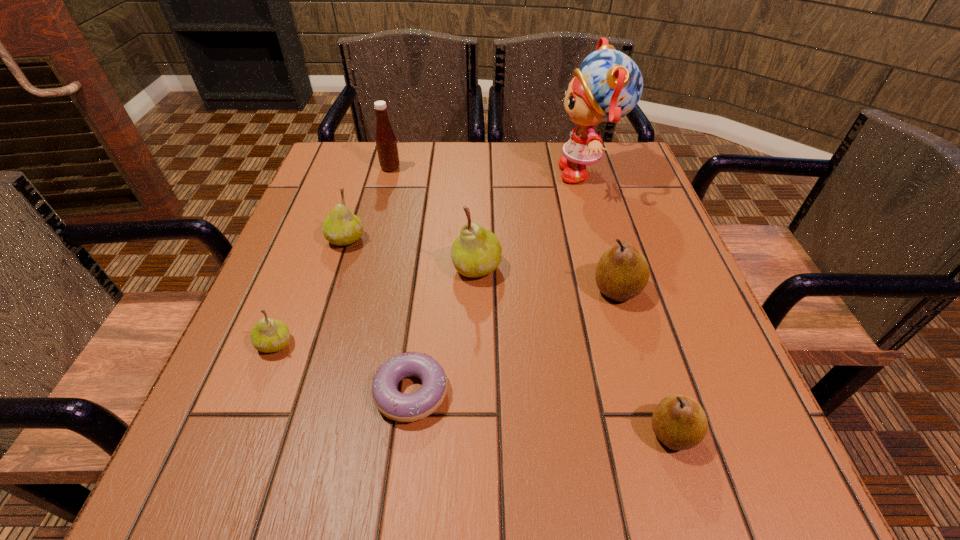
Find the location of a particular element. vacant space at the far edge of the desktop is located at coordinates (528, 178).

Where is `vacant space at the near edge of the desktop`? The width and height of the screenshot is (960, 540). vacant space at the near edge of the desktop is located at coordinates (531, 488).

Find the location of a particular element. vacant space at the left edge of the desktop is located at coordinates (314, 254).

In the image, there is a desktop. What are the coordinates of `vacant space at the right edge` in the screenshot? It's located at (634, 311).

What are the coordinates of `free region at the near right corner of the desktop` in the screenshot? It's located at (708, 442).

In order to click on free space that is in between the smallest green pear and the shortest object in this screenshot , I will do 343,368.

Image resolution: width=960 pixels, height=540 pixels. What are the coordinates of `blank region between the smallest green pear and the rightmost green pear` in the screenshot? It's located at (376, 306).

Locate an element on the screen. This screenshot has height=540, width=960. free space between the tallest object and the second biggest green pear is located at coordinates (467, 206).

Identify the location of vacant region between the third nearest object and the tallest object. (431, 258).

At what (x,y) coordinates should I click in order to perform the action: click on free area in between the smaller brown pear and the nearest green pear. Please return your answer as a coordinate pair (x, y). Image resolution: width=960 pixels, height=540 pixels. Looking at the image, I should click on (474, 388).